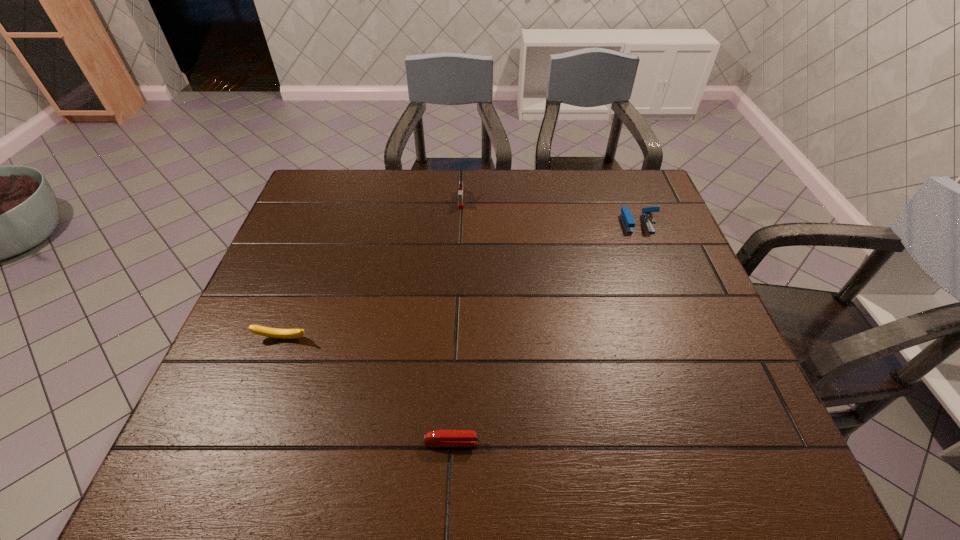
Identify the location of vacant region located 0.100m on the front-facing side of the shortest stapler. This screenshot has width=960, height=540. (530, 442).

Identify the location of object that is at the far edge. The width and height of the screenshot is (960, 540). (460, 192).

Where is `object located in the near edge section of the desktop`? The width and height of the screenshot is (960, 540). object located in the near edge section of the desktop is located at coordinates (438, 437).

At what (x,y) coordinates should I click in order to perform the action: click on object that is at the left edge. Please return your answer as a coordinate pair (x, y). Looking at the image, I should click on (256, 329).

Locate an element on the screen. object situated at the right edge is located at coordinates (626, 216).

I want to click on vacant area at the far edge, so [597, 175].

The height and width of the screenshot is (540, 960). I want to click on free spot at the near edge of the desktop, so click(330, 457).

At what (x,y) coordinates should I click in order to perform the action: click on free region at the left edge of the desktop. Please return your answer as a coordinate pair (x, y). This screenshot has width=960, height=540. Looking at the image, I should click on (342, 225).

Where is `vacant region at the right edge of the desktop`? The width and height of the screenshot is (960, 540). vacant region at the right edge of the desktop is located at coordinates (654, 302).

Identify the location of blank space at the far left corner of the desktop. (343, 171).